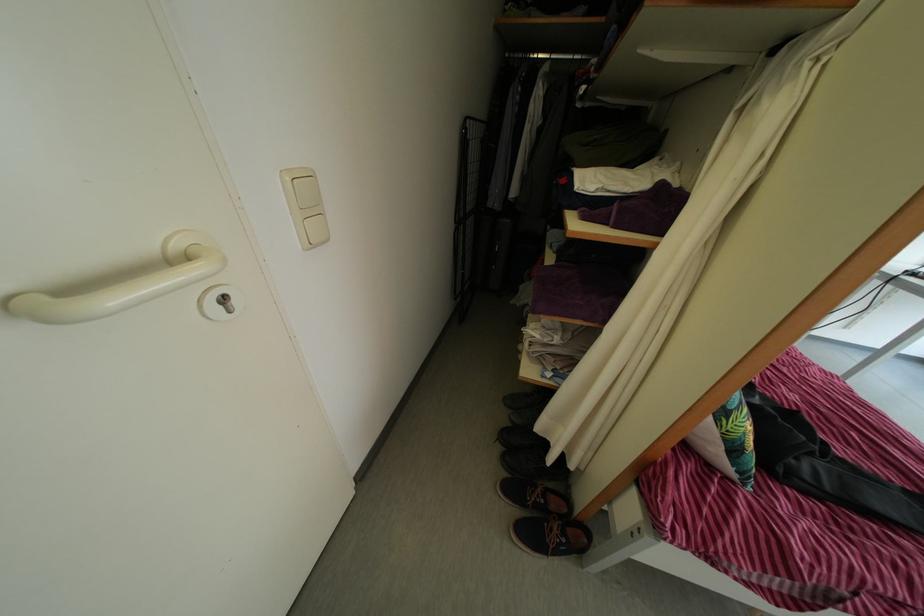
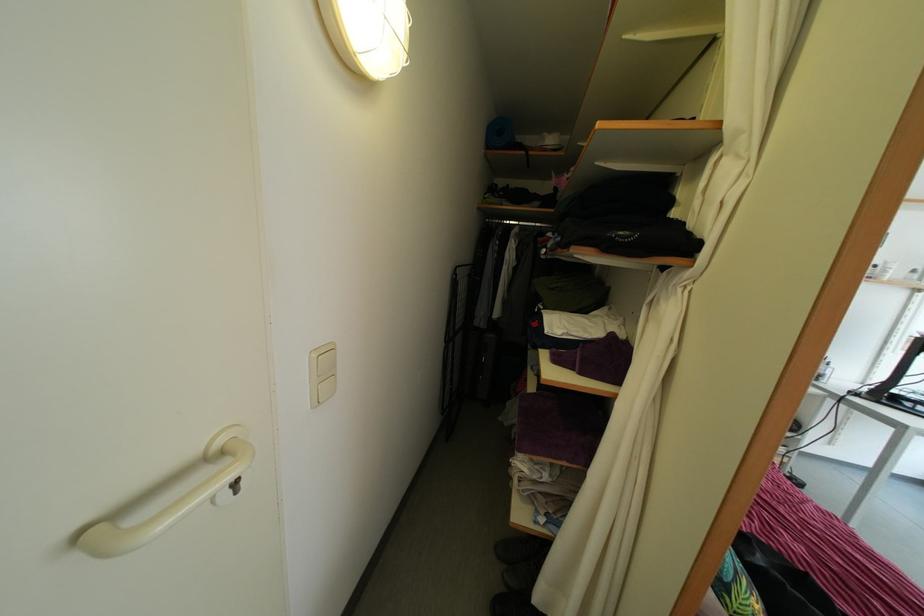
Question: What movement of the cameraman would produce the second image?

Choices:
 (A) Left
 (B) Right
 (C) Forward
 (D) Backward

Answer: (D)